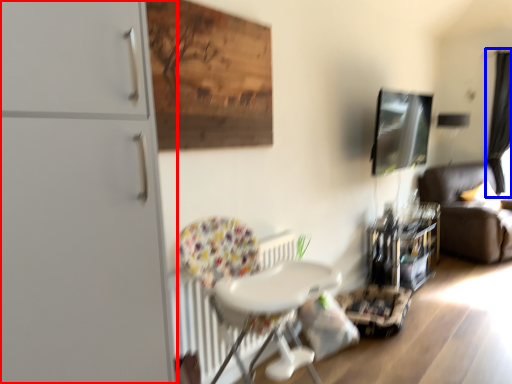
Question: Which point is closer to the camera, dresser (highlighted by a red box) or curtain (highlighted by a blue box)?

Choices:
 (A) dresser
 (B) curtain

Answer: (A)